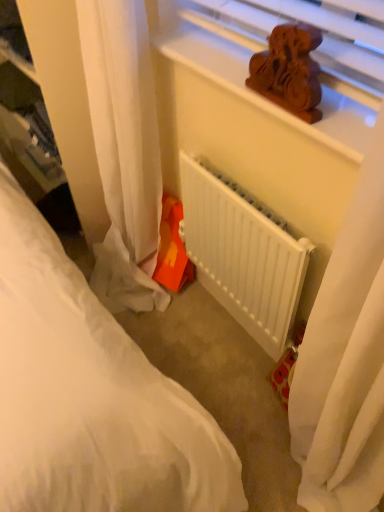
Question: Considering the relative positions of orange plastic toy at lower center and white matte radiator at center in the image provided, is orange plastic toy at lower center in front of white matte radiator at center?

Choices:
 (A) yes
 (B) no

Answer: (B)

Question: Is orange plastic toy at lower center thinner than white matte radiator at center?

Choices:
 (A) no
 (B) yes

Answer: (A)

Question: From the image's perspective, would you say orange plastic toy at lower center is positioned over white matte radiator at center?

Choices:
 (A) yes
 (B) no

Answer: (A)

Question: Can you confirm if orange plastic toy at lower center is shorter than white matte radiator at center?

Choices:
 (A) yes
 (B) no

Answer: (A)

Question: Is orange plastic toy at lower center completely or partially outside of white matte radiator at center?

Choices:
 (A) yes
 (B) no

Answer: (A)

Question: Considering the relative sizes of orange plastic toy at lower center and white matte radiator at center in the image provided, is orange plastic toy at lower center bigger than white matte radiator at center?

Choices:
 (A) yes
 (B) no

Answer: (B)

Question: Is orange plastic toy at lower center positioned with its back to brown wooden statue at upper center?

Choices:
 (A) yes
 (B) no

Answer: (B)

Question: Does orange plastic toy at lower center have a smaller size compared to brown wooden statue at upper center?

Choices:
 (A) no
 (B) yes

Answer: (A)

Question: Is orange plastic toy at lower center thinner than brown wooden statue at upper center?

Choices:
 (A) no
 (B) yes

Answer: (A)

Question: From a real-world perspective, is orange plastic toy at lower center beneath brown wooden statue at upper center?

Choices:
 (A) yes
 (B) no

Answer: (A)

Question: Considering the relative sizes of orange plastic toy at lower center and brown wooden statue at upper center in the image provided, is orange plastic toy at lower center bigger than brown wooden statue at upper center?

Choices:
 (A) no
 (B) yes

Answer: (B)

Question: Considering the relative sizes of orange plastic toy at lower center and brown wooden statue at upper center in the image provided, is orange plastic toy at lower center wider than brown wooden statue at upper center?

Choices:
 (A) yes
 (B) no

Answer: (A)

Question: Would you say brown wooden statue at upper center is a long distance from wooden carving at upper center?

Choices:
 (A) no
 (B) yes

Answer: (A)